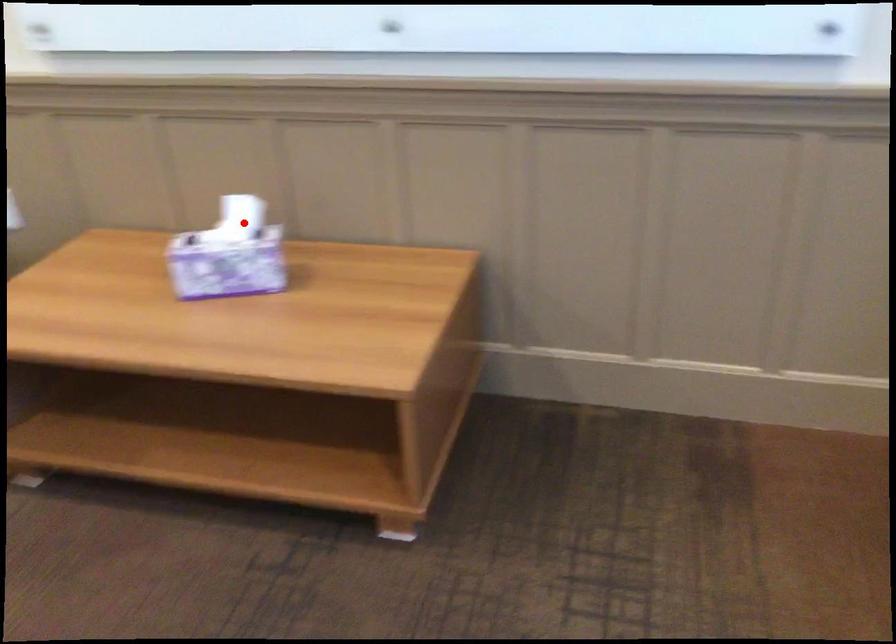
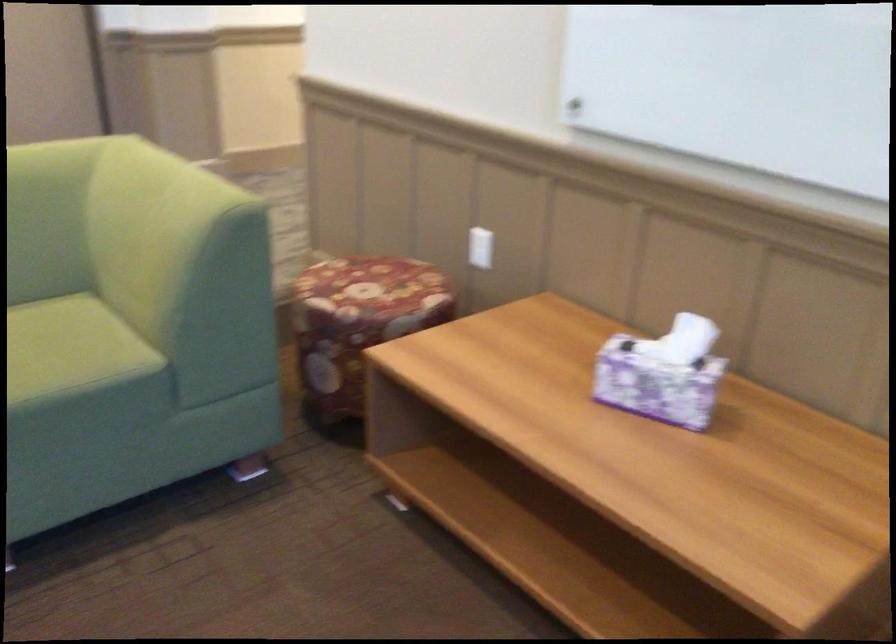
Question: I am providing you with two images of the same scene from different viewpoints. A red point is marked on the first image. Can you still see the location of the red point in image 2?

Choices:
 (A) Yes
 (B) No

Answer: (A)